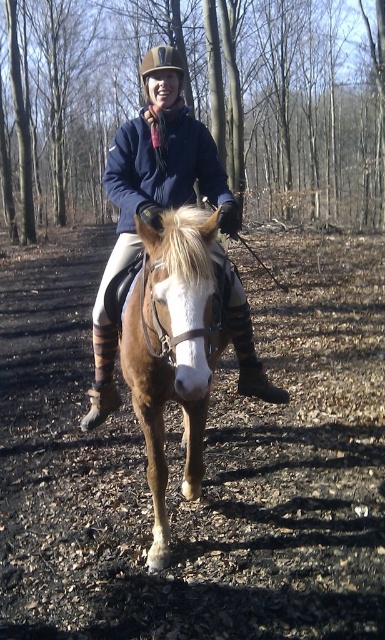
Question: Which object appears farthest from the camera in this image?

Choices:
 (A) brown glossy horse at center
 (B) matte blue jacket at center

Answer: (B)

Question: Is brown glossy horse at center smaller than matte blue jacket at center?

Choices:
 (A) yes
 (B) no

Answer: (A)

Question: Can you confirm if brown glossy horse at center is positioned below matte blue jacket at center?

Choices:
 (A) no
 (B) yes

Answer: (B)

Question: Among these objects, which one is nearest to the camera?

Choices:
 (A) matte blue jacket at center
 (B) brown glossy horse at center

Answer: (B)

Question: Considering the relative positions of brown glossy horse at center and matte blue jacket at center in the image provided, where is brown glossy horse at center located with respect to matte blue jacket at center?

Choices:
 (A) below
 (B) above

Answer: (A)

Question: Among these objects, which one is nearest to the camera?

Choices:
 (A) brown glossy horse at center
 (B) matte blue jacket at center

Answer: (A)